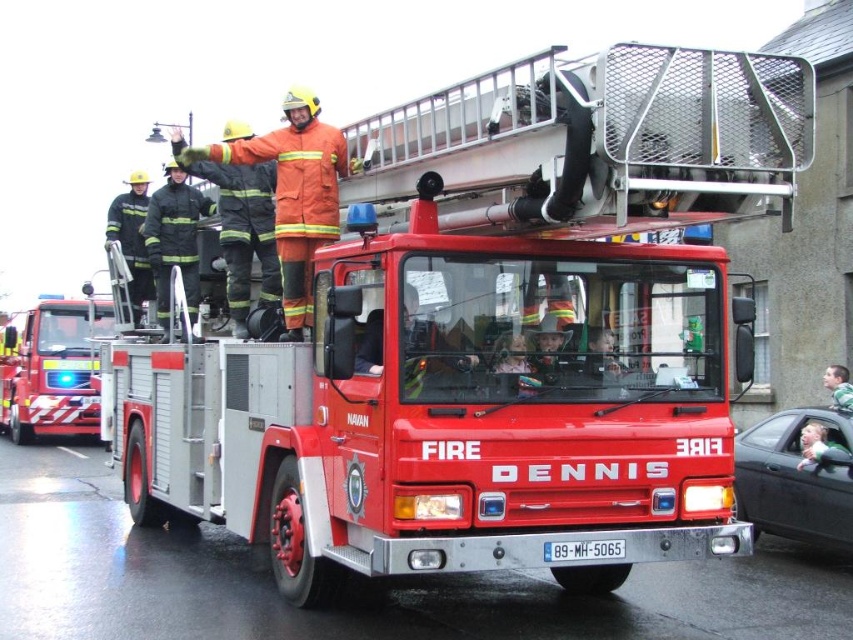
Question: Which object is farther from the camera taking this photo?

Choices:
 (A) white plastic license plate at center
 (B) orange reflective uniform at center
 (C) orange fireman at center
 (D) shiny red fire truck at left

Answer: (D)

Question: Does white plastic license plate at center come in front of green fabric shirt at center?

Choices:
 (A) no
 (B) yes

Answer: (B)

Question: Can you confirm if black fabric fireman at center is bigger than white plastic license plate at center?

Choices:
 (A) no
 (B) yes

Answer: (B)

Question: Which point is farther to the camera?

Choices:
 (A) (335, 161)
 (B) (137, 266)

Answer: (B)

Question: Can you confirm if shiny red fire truck at left is positioned to the left of green fabric shirt at center?

Choices:
 (A) yes
 (B) no

Answer: (A)

Question: Based on their relative distances, which object is farther from the black fabric fireman at center?

Choices:
 (A) orange reflective uniform at center
 (B) reflective black uniform at left
 (C) white plastic license plate at center
 (D) green fabric shirt at center

Answer: (D)